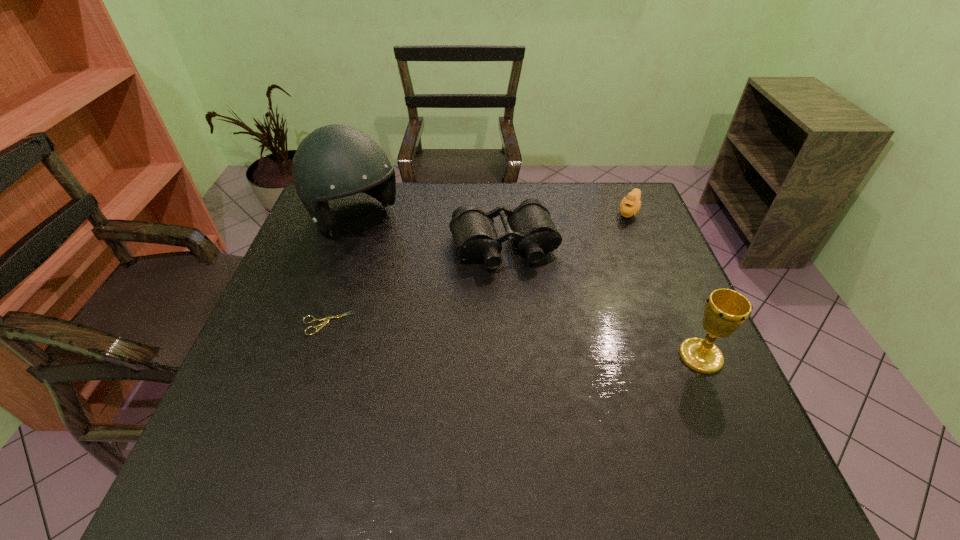
You are a GUI agent. You are given a task and a screenshot of the screen. Output one action in this format:
    pyautogui.click(x=<x>, y=<y>)
    Task: Click on the free space at the near left corner
    This screenshot has height=540, width=960.
    Given the screenshot: What is the action you would take?
    252,400

Where is `blank area at the far right corner`? blank area at the far right corner is located at coordinates (636, 223).

Locate an element on the screen. This screenshot has width=960, height=540. vacant point located between the duckling and the shortest object is located at coordinates (478, 268).

You are a GUI agent. You are given a task and a screenshot of the screen. Output one action in this format:
    pyautogui.click(x=<x>, y=<y>)
    Task: Click on the empty space that is in between the third object from left to right and the football helmet
    
    Given the screenshot: What is the action you would take?
    pyautogui.click(x=429, y=232)

Find the location of a particular element. This screenshot has height=540, width=960. vacant space in between the third object from left to right and the tallest object is located at coordinates (429, 232).

Where is `free point between the chalice and the football helmet`? The height and width of the screenshot is (540, 960). free point between the chalice and the football helmet is located at coordinates (527, 287).

I want to click on vacant space in between the fourth farthest object and the second tallest object, so pos(514,340).

Locate an element on the screen. This screenshot has width=960, height=540. unoccupied position between the third object from left to right and the shortest object is located at coordinates (416, 285).

Locate an element on the screen. This screenshot has width=960, height=540. unoccupied area between the binoculars and the second tallest object is located at coordinates (602, 301).

In order to click on free space between the tallest object and the shears in this screenshot , I will do `click(341, 271)`.